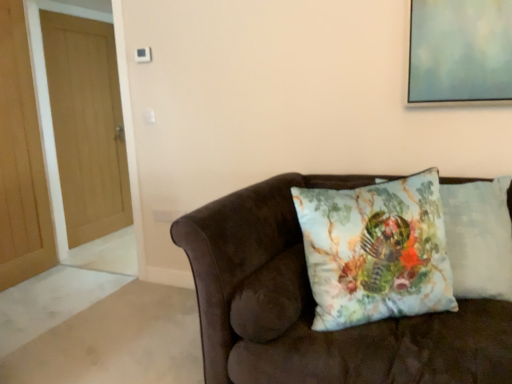
Image resolution: width=512 pixels, height=384 pixels. Describe the element at coordinates (21, 160) in the screenshot. I see `light brown wood door at left, which ranks as the 2th door in back-to-front order` at that location.

What are the coordinates of `floral cotton cushion at center, arranged as the 1th pillow when viewed from the left` in the screenshot? It's located at (376, 251).

What is the approximate width of velvet brown couch at center?

velvet brown couch at center is 1.12 meters in width.

At what (x,y) coordinates should I click in order to perform the action: click on light brown wood door at left, arranged as the 1th door when viewed from the front. Please return your answer as a coordinate pair (x, y). This screenshot has height=384, width=512. Looking at the image, I should click on (21, 160).

From a real-world perspective, who is located lower, velvet brown couch at center or light brown wood door at left, which ranks as the 2th door in back-to-front order?

velvet brown couch at center, from a real-world perspective.

Could you measure the distance between velvet brown couch at center and light brown wood door at left, which ranks as the 2th door in back-to-front order?

A distance of 2.30 meters exists between velvet brown couch at center and light brown wood door at left, which ranks as the 2th door in back-to-front order.

Between point (220, 318) and point (3, 125), which one is positioned in front?

The point (220, 318) is more forward.

Considering the sizes of objects velvet brown couch at center and light brown wood door at left, arranged as the 1th door when viewed from the front, in the image provided, who is wider, velvet brown couch at center or light brown wood door at left, arranged as the 1th door when viewed from the front,?

Wider between the two is velvet brown couch at center.

Is velvet brown couch at center further to camera compared to floral cotton cushion at center, positioned as the 2th pillow in right-to-left order?

No, it is in front of floral cotton cushion at center, positioned as the 2th pillow in right-to-left order.

Is velvet brown couch at center aimed at floral cotton cushion at center, positioned as the 2th pillow in right-to-left order?

Yes, velvet brown couch at center is facing floral cotton cushion at center, positioned as the 2th pillow in right-to-left order.

Is velvet brown couch at center to the left of floral cotton cushion at center, arranged as the 1th pillow when viewed from the left, from the viewer's perspective?

Correct, you'll find velvet brown couch at center to the left of floral cotton cushion at center, arranged as the 1th pillow when viewed from the left.

Identify the location of studio couch on the left of floral cotton cushion at center, positioned as the 2th pillow in right-to-left order. (315, 305).

Can you confirm if floral cotton cushion at center, arranged as the 1th pillow when viewed from the left, is positioned to the right of floral fabric cushion at right, the 2th pillow in the left-to-right sequence?

No.

Between floral cotton cushion at center, positioned as the 2th pillow in right-to-left order, and floral fabric cushion at right, which is the 1th pillow from right to left, which one has smaller size?

With smaller size is floral cotton cushion at center, positioned as the 2th pillow in right-to-left order.

Can floral fabric cushion at right, the 2th pillow in the left-to-right sequence, be found inside floral cotton cushion at center, arranged as the 1th pillow when viewed from the left?

No.

From the image's perspective, which one is positioned lower, floral cotton cushion at center, arranged as the 1th pillow when viewed from the left, or wooden door at left, the 1th door from the back?

From the image's view, floral cotton cushion at center, arranged as the 1th pillow when viewed from the left, is below.

Find the location of a particular element. pillow that is the 2nd object located in front of the wooden door at left, the 1th door from the back is located at coordinates (376, 251).

Could you tell me if floral cotton cushion at center, arranged as the 1th pillow when viewed from the left, is turned towards wooden door at left, the 1th door from the back?

No, floral cotton cushion at center, arranged as the 1th pillow when viewed from the left, is not turned towards wooden door at left, the 1th door from the back.

Is wooden door at left, which is the second door from front to back, positioned with its back to light brown wood door at left, which ranks as the 2th door in back-to-front order?

wooden door at left, which is the second door from front to back, is not turned away from light brown wood door at left, which ranks as the 2th door in back-to-front order.

How many degrees apart are the facing directions of wooden door at left, the 1th door from the back, and light brown wood door at left, arranged as the 1th door when viewed from the front?

The facing directions of wooden door at left, the 1th door from the back, and light brown wood door at left, arranged as the 1th door when viewed from the front, are 5.69 degrees apart.

From the image's perspective, who appears lower, wooden door at left, the 1th door from the back, or light brown wood door at left, which ranks as the 2th door in back-to-front order?

light brown wood door at left, which ranks as the 2th door in back-to-front order.

Does point (60, 83) appear closer or farther from the camera than point (42, 179)?

Point (60, 83) appears to be farther away from the viewer than point (42, 179).

Which object is closer to the camera, floral fabric cushion at right, the 2th pillow in the left-to-right sequence, or light brown wood door at left, which ranks as the 2th door in back-to-front order?

floral fabric cushion at right, the 2th pillow in the left-to-right sequence, is closer to the camera.

Choose the correct answer: Is floral fabric cushion at right, the 2th pillow in the left-to-right sequence, inside light brown wood door at left, which ranks as the 2th door in back-to-front order, or outside it?

floral fabric cushion at right, the 2th pillow in the left-to-right sequence, cannot be found inside light brown wood door at left, which ranks as the 2th door in back-to-front order.

Identify the location of the 1st door behind the floral fabric cushion at right, which is the 1th pillow from right to left, counting from the anchor's position. The height and width of the screenshot is (384, 512). (21, 160).

Is there a large distance between floral fabric cushion at right, which is the 1th pillow from right to left, and light brown wood door at left, which ranks as the 2th door in back-to-front order?

floral fabric cushion at right, which is the 1th pillow from right to left, is positioned a significant distance from light brown wood door at left, which ranks as the 2th door in back-to-front order.

Does velvet brown couch at center turn towards floral fabric cushion at right, the 2th pillow in the left-to-right sequence?

No, velvet brown couch at center is not facing towards floral fabric cushion at right, the 2th pillow in the left-to-right sequence.

From the velvet brown couch at center, count 2nd pillows backward and point to it. Please provide its 2D coordinates.

[(479, 238)]

Does velvet brown couch at center lie in front of floral fabric cushion at right, the 2th pillow in the left-to-right sequence?

Yes, velvet brown couch at center is closer to the camera.

Which is farther, (x=255, y=362) or (x=458, y=277)?

The point (x=458, y=277) is farther from the camera.

From the velvet brown couch at center, count the 2nd door to the left and point to it. Please provide its 2D coordinates.

[(21, 160)]

At what (x,y) coordinates should I click in order to perform the action: click on studio couch in front of the floral cotton cushion at center, arranged as the 1th pillow when viewed from the left. Please return your answer as a coordinate pair (x, y). This screenshot has height=384, width=512. Looking at the image, I should click on (315, 305).

Estimate the real-world distances between objects in this image. Which object is further from light brown wood door at left, which ranks as the 2th door in back-to-front order, velvet brown couch at center or floral fabric cushion at right, which is the 1th pillow from right to left?

The object further to light brown wood door at left, which ranks as the 2th door in back-to-front order, is floral fabric cushion at right, which is the 1th pillow from right to left.

Which object lies nearer to the anchor point floral fabric cushion at right, which is the 1th pillow from right to left, light brown wood door at left, which ranks as the 2th door in back-to-front order, or floral cotton cushion at center, positioned as the 2th pillow in right-to-left order?

The object closer to floral fabric cushion at right, which is the 1th pillow from right to left, is floral cotton cushion at center, positioned as the 2th pillow in right-to-left order.

From the image, which object appears to be farther from floral fabric cushion at right, the 2th pillow in the left-to-right sequence, light brown wood door at left, arranged as the 1th door when viewed from the front, or velvet brown couch at center?

Among the two, light brown wood door at left, arranged as the 1th door when viewed from the front, is located further to floral fabric cushion at right, the 2th pillow in the left-to-right sequence.

Considering their positions, is wooden door at left, the 1th door from the back, positioned closer to velvet brown couch at center than floral fabric cushion at right, which is the 1th pillow from right to left?

floral fabric cushion at right, which is the 1th pillow from right to left, is positioned closer to the anchor velvet brown couch at center.

From the picture: From the image, which object appears to be farther from floral cotton cushion at center, arranged as the 1th pillow when viewed from the left, floral fabric cushion at right, the 2th pillow in the left-to-right sequence, or wooden door at left, which is the second door from front to back?

wooden door at left, which is the second door from front to back.

Consider the image. Which object lies nearer to the anchor point floral fabric cushion at right, which is the 1th pillow from right to left, floral cotton cushion at center, positioned as the 2th pillow in right-to-left order, or velvet brown couch at center?

floral cotton cushion at center, positioned as the 2th pillow in right-to-left order.

When comparing their distances from wooden door at left, which is the second door from front to back, does floral fabric cushion at right, the 2th pillow in the left-to-right sequence, or velvet brown couch at center seem further?

Among the two, floral fabric cushion at right, the 2th pillow in the left-to-right sequence, is located further to wooden door at left, which is the second door from front to back.

Estimate the real-world distances between objects in this image. Which object is closer to floral fabric cushion at right, the 2th pillow in the left-to-right sequence, wooden door at left, which is the second door from front to back, or floral cotton cushion at center, positioned as the 2th pillow in right-to-left order?

Based on the image, floral cotton cushion at center, positioned as the 2th pillow in right-to-left order, appears to be nearer to floral fabric cushion at right, the 2th pillow in the left-to-right sequence.

Find the location of `studio couch between light brown wood door at left, which ranks as the 2th door in back-to-front order, and floral cotton cushion at center, positioned as the 2th pillow in right-to-left order, in the horizontal direction`. studio couch between light brown wood door at left, which ranks as the 2th door in back-to-front order, and floral cotton cushion at center, positioned as the 2th pillow in right-to-left order, in the horizontal direction is located at coordinates (315, 305).

The height and width of the screenshot is (384, 512). In order to click on pillow between velvet brown couch at center and floral fabric cushion at right, the 2th pillow in the left-to-right sequence, from front to back in this screenshot , I will do click(376, 251).

The height and width of the screenshot is (384, 512). I want to click on pillow situated between light brown wood door at left, arranged as the 1th door when viewed from the front, and floral fabric cushion at right, the 2th pillow in the left-to-right sequence, from left to right, so click(x=376, y=251).

The height and width of the screenshot is (384, 512). Identify the location of door positioned between velvet brown couch at center and wooden door at left, the 1th door from the back, from near to far. point(21,160).